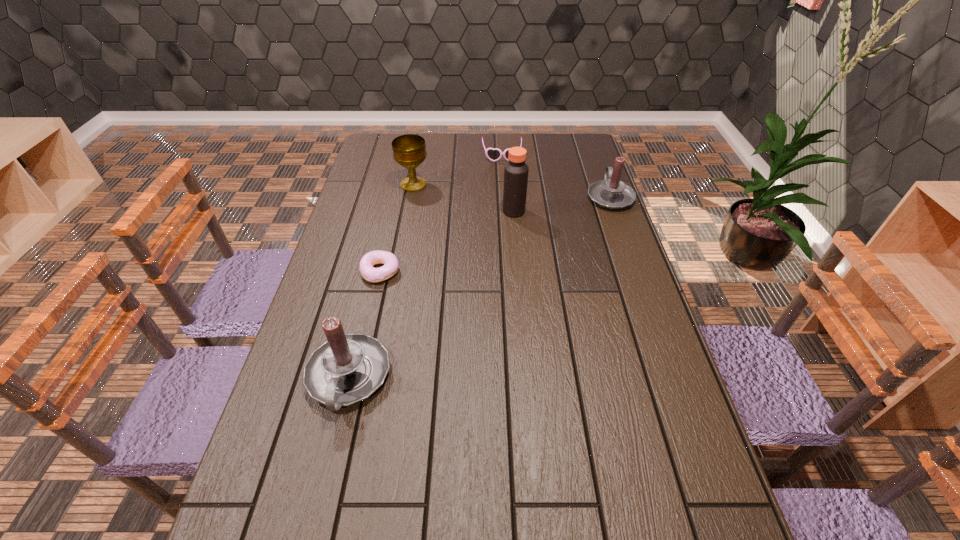
Locate an element on the screen. vacant space located 0.060m on the side of the nearest object with the handle loop is located at coordinates (330, 450).

At what (x,y) coordinates should I click in order to perform the action: click on free spot located 0.100m on the side of the farther candle with the handle loop. Please return your answer as a coordinate pair (x, y). The image size is (960, 540). Looking at the image, I should click on pyautogui.click(x=600, y=168).

I want to click on vacant space located 0.070m on the side of the farther candle with the handle loop, so click(601, 172).

In order to click on free space located on the side of the farther candle with the handle loop in this screenshot , I will do `click(598, 164)`.

At what (x,y) coordinates should I click in order to perform the action: click on vacant position located on the front-facing side of the second shortest object. Please return your answer as a coordinate pair (x, y). The width and height of the screenshot is (960, 540). Looking at the image, I should click on coord(505,205).

Locate an element on the screen. The width and height of the screenshot is (960, 540). free space located on the right of the chalice is located at coordinates (487, 185).

Where is `vacant space located 0.250m on the front of the vinegar`? Image resolution: width=960 pixels, height=540 pixels. vacant space located 0.250m on the front of the vinegar is located at coordinates (519, 269).

Locate an element on the screen. The height and width of the screenshot is (540, 960). free point located on the left of the shortest object is located at coordinates (341, 272).

Where is `object at the far edge`? object at the far edge is located at coordinates (492, 154).

The height and width of the screenshot is (540, 960). In order to click on candle situated at the left edge in this screenshot , I will do `click(348, 368)`.